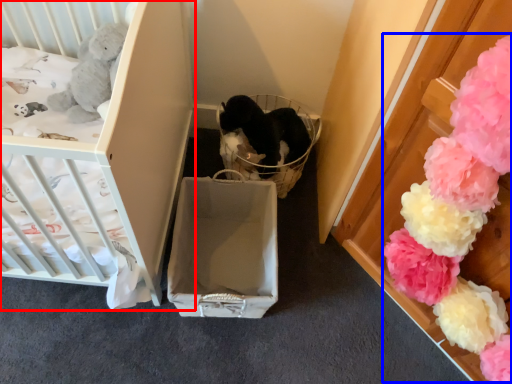
Question: Which object is closer to the camera taking this photo, infant bed (highlighted by a red box) or flower (highlighted by a blue box)?

Choices:
 (A) infant bed
 (B) flower

Answer: (B)